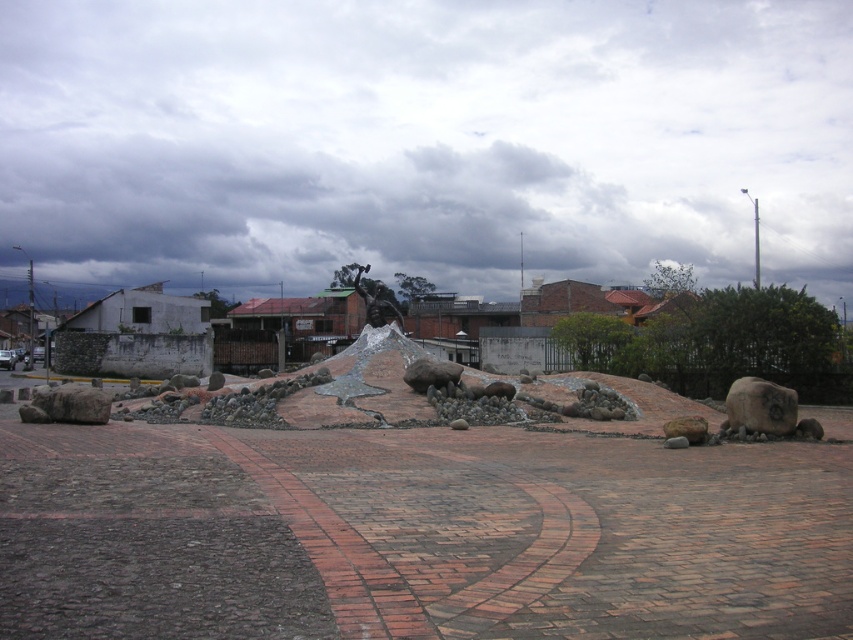
Question: Is smooth gray rock at right wider than shiny bronze statue at center?

Choices:
 (A) yes
 (B) no

Answer: (B)

Question: Can you confirm if smooth gray rock at right is positioned above shiny bronze statue at center?

Choices:
 (A) yes
 (B) no

Answer: (B)

Question: In this image, where is smooth gray rock at right located relative to shiny bronze statue at center?

Choices:
 (A) below
 (B) above

Answer: (A)

Question: Which of the following is the farthest from the observer?

Choices:
 (A) shiny bronze statue at center
 (B) smooth gray rock at right

Answer: (A)

Question: Among these points, which one is nearest to the camera?

Choices:
 (A) (746, 397)
 (B) (376, 300)

Answer: (A)

Question: Which point is farther to the camera?

Choices:
 (A) shiny bronze statue at center
 (B) smooth gray rock at right

Answer: (A)